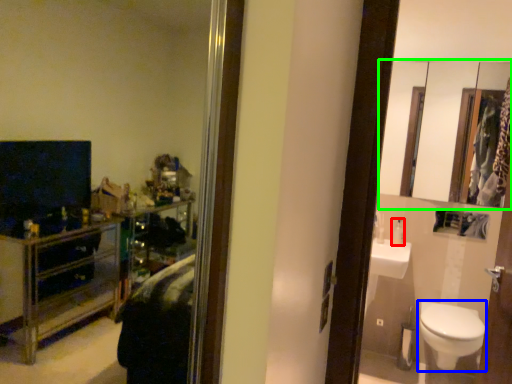
Question: Considering the real-world distances, which object is farthest from toiletry (highlighted by a red box)? toilet (highlighted by a blue box) or mirror (highlighted by a green box)?

Choices:
 (A) toilet
 (B) mirror

Answer: (B)